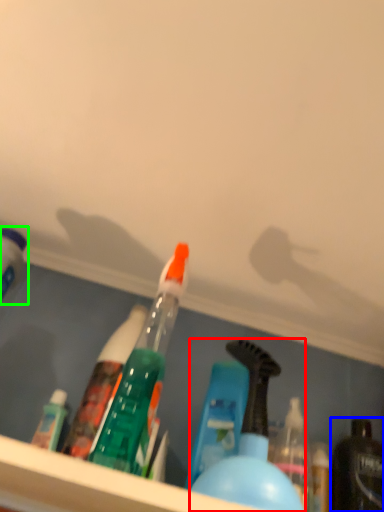
Question: Which object is positioned farthest from bottle (highlighted by a red box)? Select from bottle (highlighted by a blue box) and bottle (highlighted by a green box).

Choices:
 (A) bottle
 (B) bottle

Answer: (B)